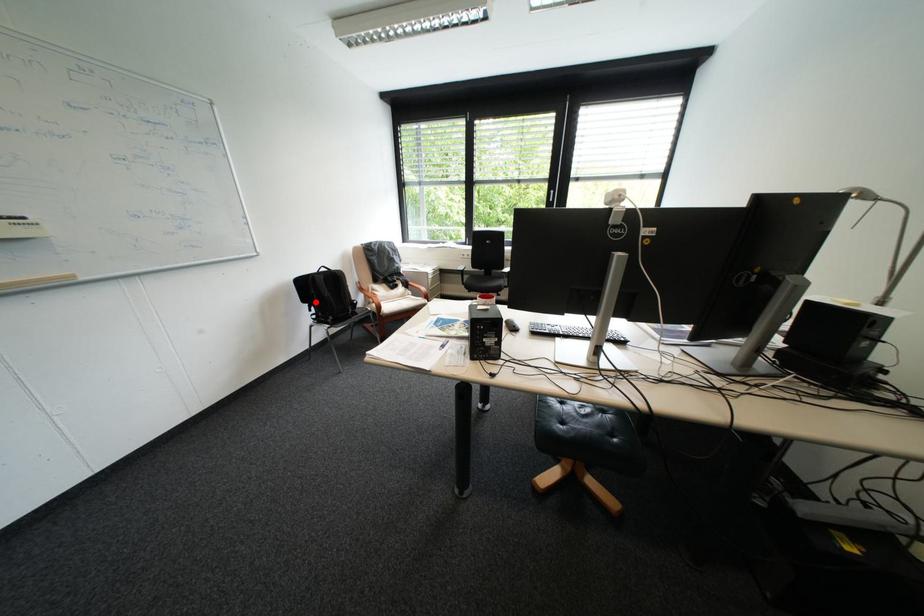
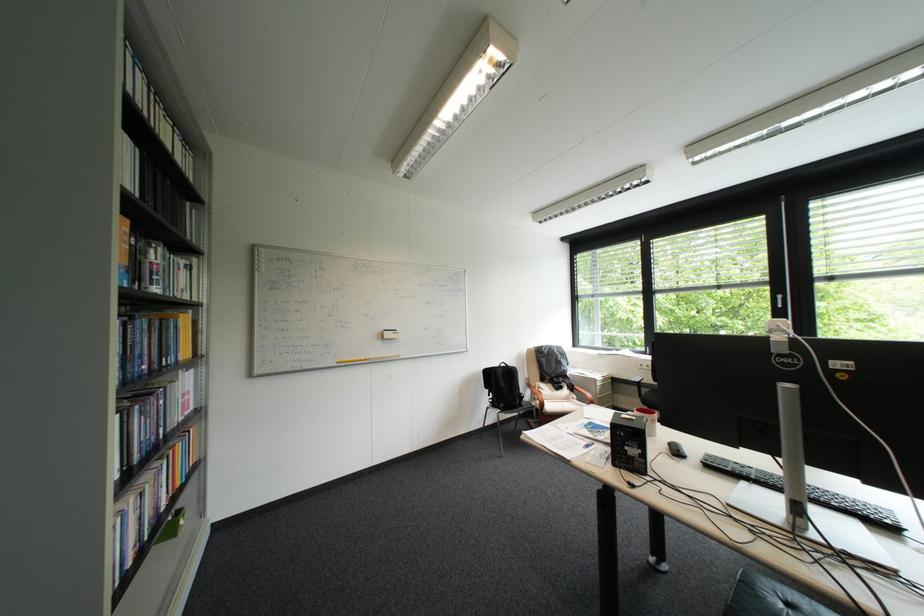
Question: I am providing you with two images of the same scene from different viewpoints. In image1, a red point is highlighted. Considering the same 3D point in image2, which of the following is correct?

Choices:
 (A) It is closer
 (B) It is farther

Answer: (B)